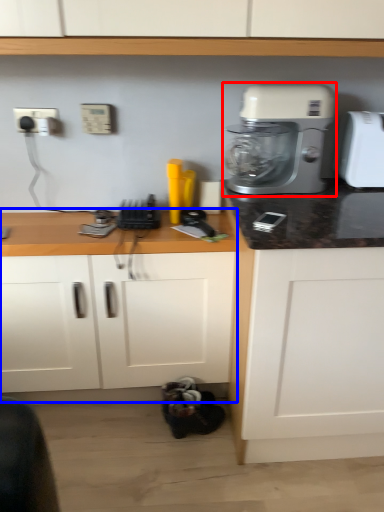
Question: Among these objects, which one is farthest to the camera, mixer (highlighted by a red box) or counter (highlighted by a blue box)?

Choices:
 (A) mixer
 (B) counter

Answer: (B)